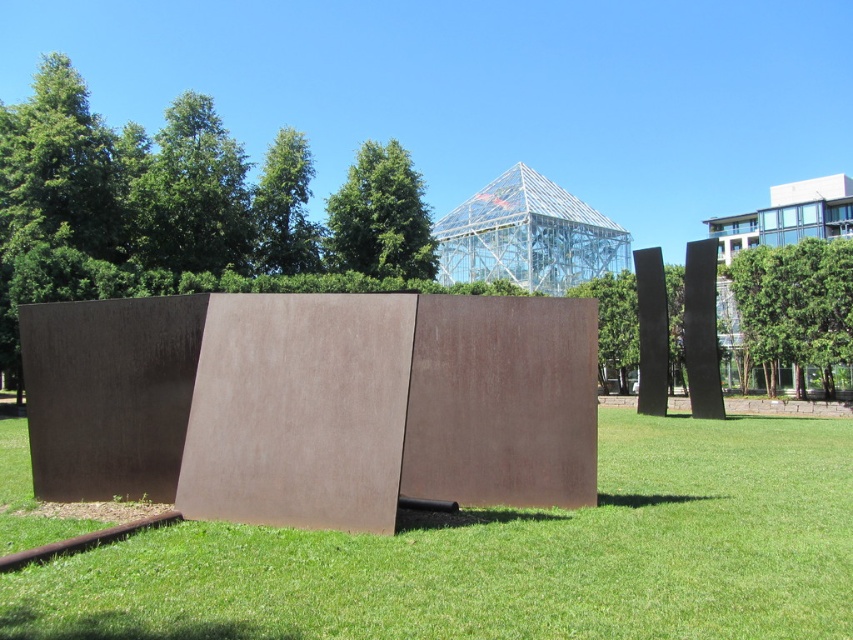
You are standing on the green grass at center and looking up. Is the transparent glass pyramid at upper center above you or behind you?

The green grass at center is positioned under the transparent glass pyramid at upper center, so the transparent glass pyramid at upper center is above you.